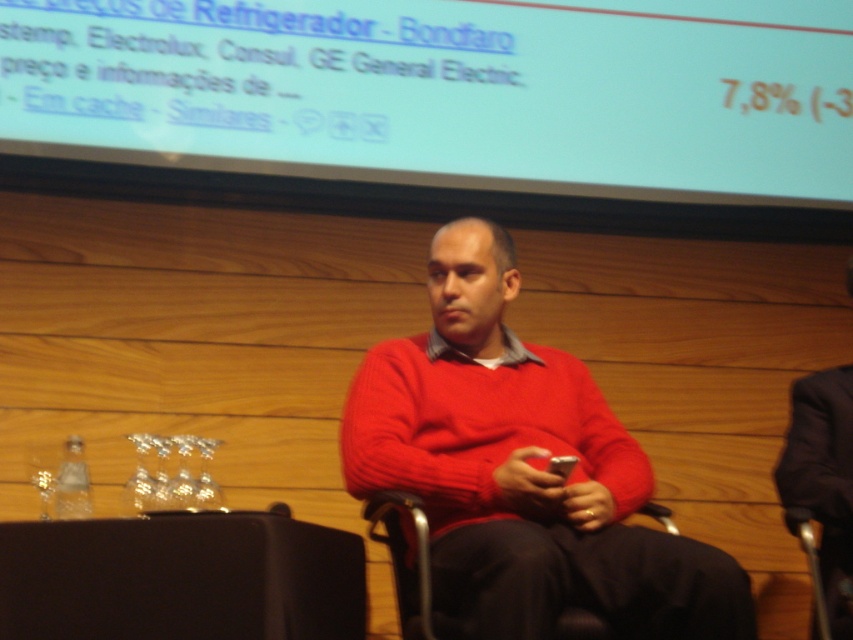
Question: Considering the relative positions of white matte projection screen at upper center and metallic silver chair at center in the image provided, where is white matte projection screen at upper center located with respect to metallic silver chair at center?

Choices:
 (A) above
 (B) below

Answer: (A)

Question: Is white matte projection screen at upper center below metallic silver chair at center?

Choices:
 (A) yes
 (B) no

Answer: (B)

Question: Which point is closer to the camera?

Choices:
 (A) (194, 160)
 (B) (511, 529)

Answer: (B)

Question: Which object is farther from the camera taking this photo?

Choices:
 (A) white matte projection screen at upper center
 (B) knitted red sweater at center

Answer: (A)

Question: Which object appears closest to the camera in this image?

Choices:
 (A) knitted red sweater at center
 (B) white matte projection screen at upper center
 (C) metallic silver chair at center

Answer: (A)

Question: Does white matte projection screen at upper center appear under knitted red sweater at center?

Choices:
 (A) no
 (B) yes

Answer: (A)